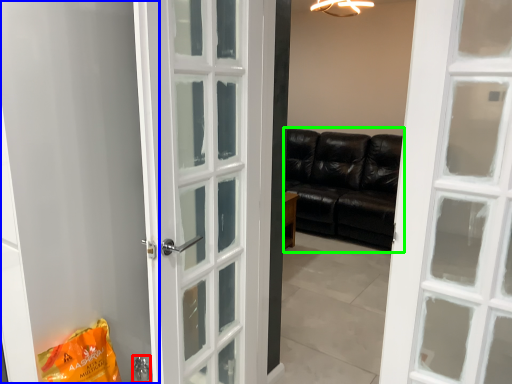
Question: Which object is positioned closest to door handle (highlighted by a red box)? Select from screen door (highlighted by a blue box) and studio couch (highlighted by a green box).

Choices:
 (A) screen door
 (B) studio couch

Answer: (A)